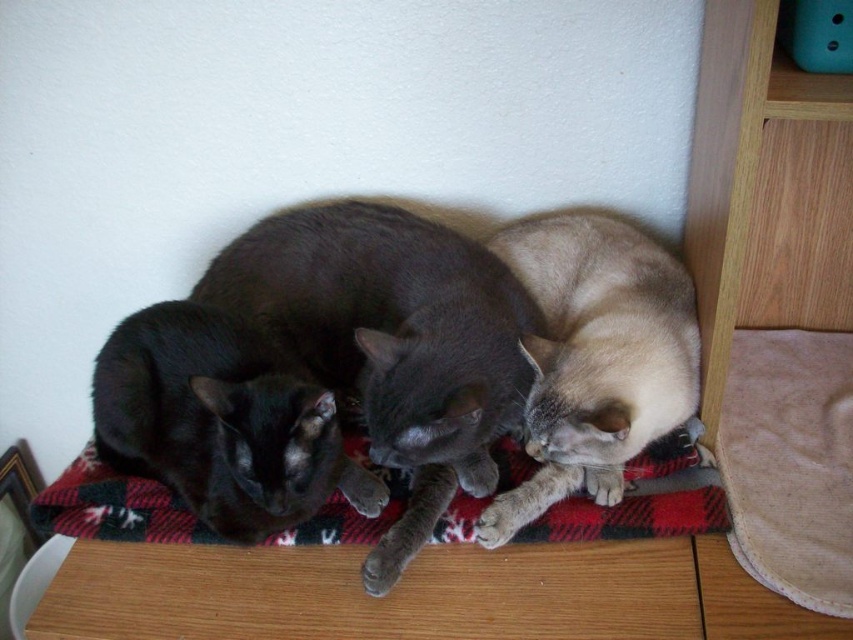
Question: Which is farther from the black fur cat at left?

Choices:
 (A) red plaid fabric at center
 (B) shiny black cat at center

Answer: (B)

Question: Which point appears farthest from the camera in this image?

Choices:
 (A) (672, 524)
 (B) (302, 211)

Answer: (B)

Question: Does satin beige cat at lower right have a smaller size compared to red plaid fabric at center?

Choices:
 (A) no
 (B) yes

Answer: (A)

Question: Does shiny black cat at center appear over satin beige cat at lower right?

Choices:
 (A) no
 (B) yes

Answer: (B)

Question: Can you confirm if shiny black cat at center is positioned below red plaid fabric at center?

Choices:
 (A) yes
 (B) no

Answer: (B)

Question: Estimate the real-world distances between objects in this image. Which object is farther from the shiny black cat at center?

Choices:
 (A) red plaid fabric at center
 (B) black fur cat at left
 (C) satin beige cat at lower right

Answer: (A)